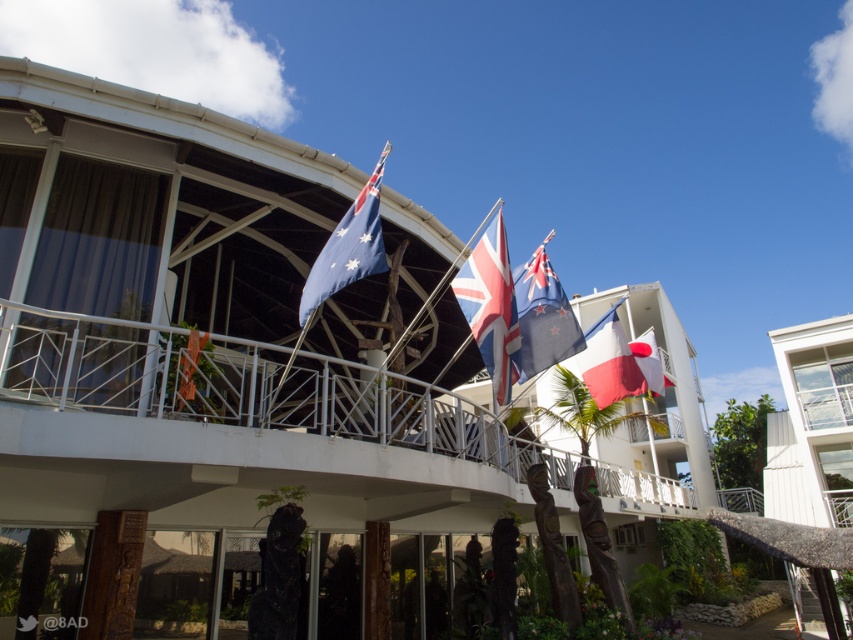
You are standing at the entrance of the modern building and want to walk towards the point labeled as point (596, 371). However, there is an obstacle at point (492, 356). Can you reach your destination without going around the obstacle?

Since point (492, 356) is in front of point (596, 371), the obstacle is blocking the path. Therefore, you cannot reach point (596, 371) without going around the obstacle.

You are standing in front of the modern architectural structure and want to take a photo that includes both point (572, 317) and point (653, 396). Which point will appear larger in your photo?

Point (572, 317) will appear larger in your photo because it is closer to the camera than point (653, 396).